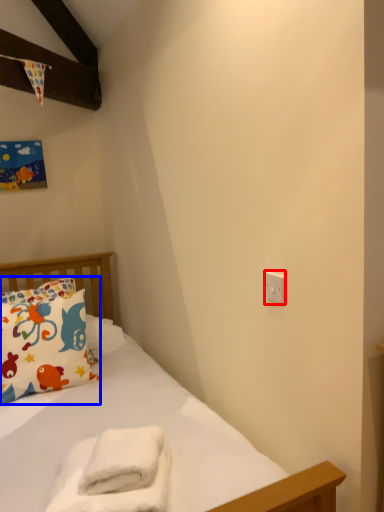
Question: Which object is further to the camera taking this photo, electric outlet (highlighted by a red box) or pillow (highlighted by a blue box)?

Choices:
 (A) electric outlet
 (B) pillow

Answer: (B)